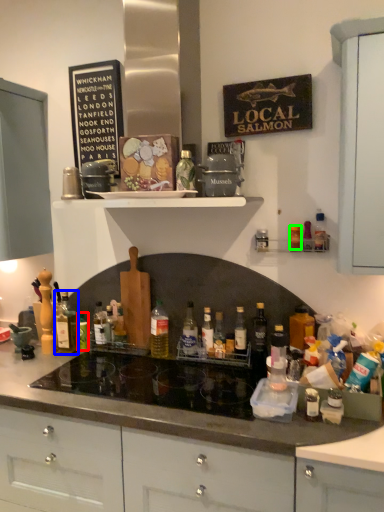
Question: Which object is positioned closest to bottle (highlighted by a red box)? Select from bottle (highlighted by a blue box) and bottle (highlighted by a green box).

Choices:
 (A) bottle
 (B) bottle

Answer: (A)